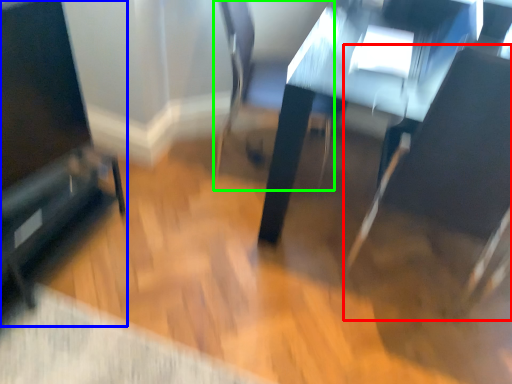
Question: Which is nearer to the swivel chair (highlighted by a red box)? furniture (highlighted by a blue box) or swivel chair (highlighted by a green box).

Choices:
 (A) furniture
 (B) swivel chair

Answer: (B)